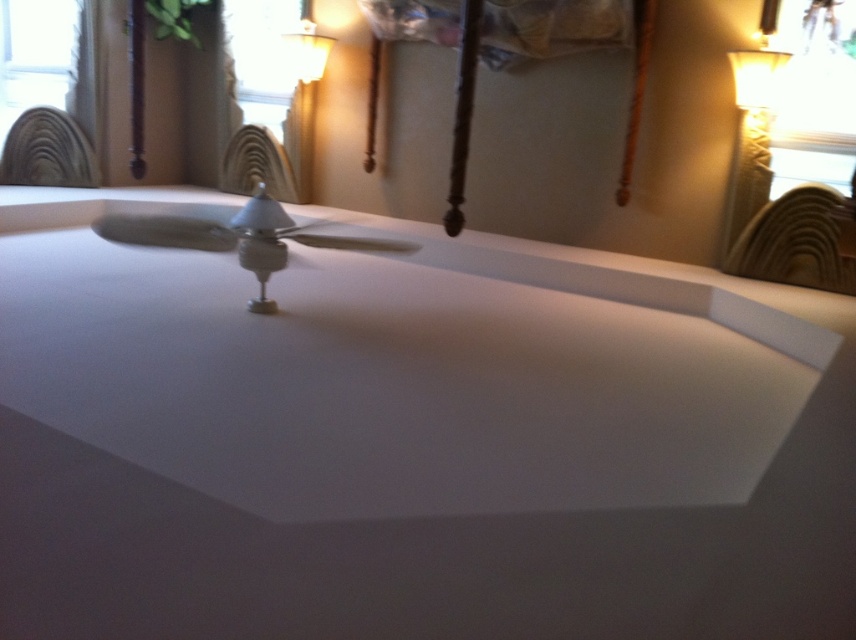
You are sitting at the white glossy table at center and want to turn on the white ceramic lampshade at upper right. Can you reach it from your current position?

The white glossy table at center is positioned under the white ceramic lampshade at upper right, so you can reach it from your current position.

You are standing in a room with a ceiling fan and two windows. There are two points marked in the image. The first point is at coordinates point (736, 605) and the second is at point (308, 28). Which point is closer to your eyes?

Point (736, 605) is closer to the camera than point (308, 28).

You are looking up at the ceiling and see the white ceramic lampshade at upper right and the matte white lampshade at upper center. Which lampshade is closer to your eyes?

The white ceramic lampshade at upper right is closer to the viewer than the matte white lampshade at upper center.